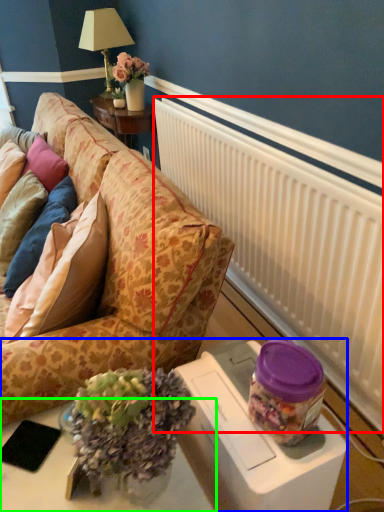
Question: Estimate the real-world distances between objects in this image. Which object is farther from radiator (highlighted by a red box), table (highlighted by a blue box) or table (highlighted by a green box)?

Choices:
 (A) table
 (B) table

Answer: (B)